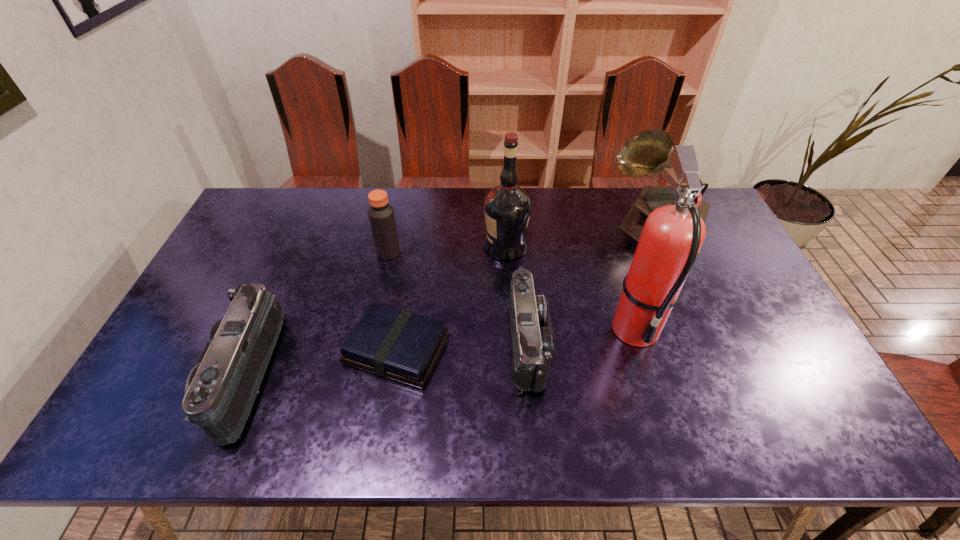
At what (x,y) coordinates should I click in order to perform the action: click on free region located 0.220m on the back of the book. Please return your answer as a coordinate pair (x, y). The image size is (960, 540). Looking at the image, I should click on pyautogui.click(x=411, y=260).

I want to click on vacant space located 0.050m on the hose direction of the fire extinguisher, so click(651, 381).

Where is `object that is at the far edge`? object that is at the far edge is located at coordinates (648, 153).

Where is `book that is at the near edge`? Image resolution: width=960 pixels, height=540 pixels. book that is at the near edge is located at coordinates (393, 343).

This screenshot has width=960, height=540. I want to click on object that is at the right edge, so click(648, 153).

Locate an element on the screen. object that is at the far right corner is located at coordinates (648, 153).

In the image, there is a desktop. Where is `free space at the far edge`? The image size is (960, 540). free space at the far edge is located at coordinates (605, 207).

Find the location of a particular element. vacant point at the near edge is located at coordinates (485, 397).

Where is `vacant space at the left edge`? This screenshot has height=540, width=960. vacant space at the left edge is located at coordinates (219, 261).

Locate an element on the screen. The width and height of the screenshot is (960, 540). vacant region at the right edge of the desktop is located at coordinates (748, 289).